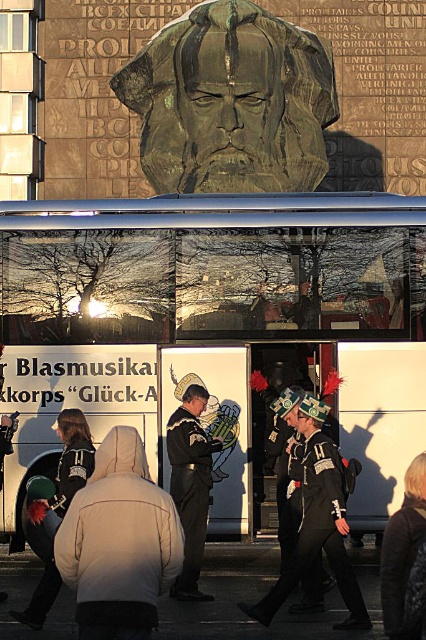
Question: Which object is the farthest from the black leather uniform at center?

Choices:
 (A) black leather hat at center
 (B) bronze relief at upper center
 (C) black matte uniform at center
 (D) white glossy bus at center

Answer: (B)

Question: Is bronze relief at upper center below black matte uniform at center?

Choices:
 (A) yes
 (B) no

Answer: (B)

Question: Which object is farther from the camera taking this photo?

Choices:
 (A) white glossy bus at center
 (B) brushed metal helmet at lower left

Answer: (A)

Question: Which of the following is the farthest from the observer?

Choices:
 (A) (325, 525)
 (B) (184, 161)
 (C) (23, 620)

Answer: (B)

Question: Observing the image, what is the correct spatial positioning of black matte uniform at center in reference to brushed metal helmet at lower left?

Choices:
 (A) below
 (B) above

Answer: (A)

Question: Does white matte jacket at lower left appear on the right side of brushed metal helmet at lower left?

Choices:
 (A) no
 (B) yes

Answer: (B)